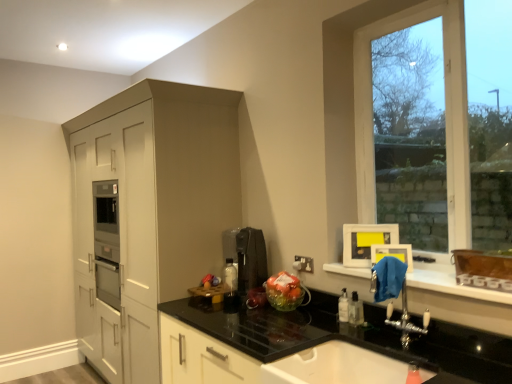
At what (x,y) coordinates should I click in order to perform the action: click on black plastic coffee machine at center. Please return your answer as a coordinate pair (x, y). This screenshot has height=384, width=512. Looking at the image, I should click on (247, 256).

Describe the element at coordinates (347, 336) in the screenshot. I see `black granite countertop at center` at that location.

At what (x,y) coordinates should I click in order to perform the action: click on clear glass window at upper right. Please return your answer as a coordinate pair (x, y). The image size is (512, 384). Looking at the image, I should click on tap(445, 106).

Where is `white glossy sink at lower center`? Image resolution: width=512 pixels, height=384 pixels. white glossy sink at lower center is located at coordinates (335, 366).

Measure the distance between point [275,372] and camera.

Point [275,372] is 5.28 feet away from camera.

Find the location of a particular element. The width and height of the screenshot is (512, 384). blue fabric at lower right is located at coordinates (451, 283).

Is blue fabric at lower right not inside clear plastic bottle at lower right?

Absolutely, blue fabric at lower right is external to clear plastic bottle at lower right.

How different are the orientations of blue fabric at lower right and clear plastic bottle at lower right in degrees?

The angle between the facing direction of blue fabric at lower right and the facing direction of clear plastic bottle at lower right is 0.999 degrees.

From the picture: Which is more to the right, blue fabric at lower right or clear plastic bottle at lower right?

From the viewer's perspective, blue fabric at lower right appears more on the right side.

Measure the distance from blue fabric at lower right to clear plastic bottle at lower right.

blue fabric at lower right and clear plastic bottle at lower right are 14.90 inches apart.

From a real-world perspective, is black plastic coffee machine at center above or below matte white cabinet at left?

Clearly, from a real-world perspective, black plastic coffee machine at center is above matte white cabinet at left.

Can you confirm if black plastic coffee machine at center is bigger than matte white cabinet at left?

Actually, black plastic coffee machine at center might be smaller than matte white cabinet at left.

Measure the distance between black plastic coffee machine at center and matte white cabinet at left.

28.58 inches.

Which of these two, matte white cabinet at left or clear glass window at upper right, stands taller?

With more height is matte white cabinet at left.

Image resolution: width=512 pixels, height=384 pixels. In order to click on window above the matte white cabinet at left (from the image's perspective) in this screenshot , I will do `click(445, 106)`.

Is matte white cabinet at left touching clear glass window at upper right?

matte white cabinet at left and clear glass window at upper right are clearly separated.

Considering the relative sizes of matte white cabinet at left and clear glass window at upper right in the image provided, is matte white cabinet at left thinner than clear glass window at upper right?

No.

In terms of width, does matte white cabinet at left look wider or thinner when compared to blue fabric at lower right?

In the image, matte white cabinet at left appears to be wider than blue fabric at lower right.

Between point (80, 179) and point (434, 278), which one is positioned behind?

Point (80, 179)

From the image's perspective, does matte white cabinet at left appear higher than blue fabric at lower right?

No, from the image's perspective, matte white cabinet at left is not on top of blue fabric at lower right.

Considering the sizes of objects clear plastic bottle at lower right and black plastic coffee machine at center in the image provided, who is thinner, clear plastic bottle at lower right or black plastic coffee machine at center?

clear plastic bottle at lower right is thinner.

Who is shorter, clear plastic bottle at lower right or black plastic coffee machine at center?

Standing shorter between the two is clear plastic bottle at lower right.

Is clear plastic bottle at lower right positioned with its back to black plastic coffee machine at center?

That's not correct — clear plastic bottle at lower right is not looking away from black plastic coffee machine at center.

Is there a large distance between clear plastic bottle at lower right and black plastic coffee machine at center?

They are positioned close to each other.

From their relative heights in the image, would you say blue fabric at lower right is taller or shorter than matte white cabinet at left?

In the image, blue fabric at lower right appears to be shorter than matte white cabinet at left.

Can you see blue fabric at lower right touching matte white cabinet at left?

No, blue fabric at lower right is not beside matte white cabinet at left.

Is blue fabric at lower right turned away from matte white cabinet at left?

No, blue fabric at lower right's orientation is not away from matte white cabinet at left.

Based on the photo, is matte white cabinet at left positioned in front of clear plastic bottle at lower right?

No, matte white cabinet at left is behind clear plastic bottle at lower right.

Is point (160, 109) behind point (359, 313)?

Yes, it is.

In the scene shown: Between matte white cabinet at left and clear plastic bottle at lower right, which one has smaller size?

Smaller between the two is clear plastic bottle at lower right.

From a real-world perspective, does matte white cabinet at left stand above clear plastic bottle at lower right?

Correct, in the physical world, matte white cabinet at left is higher than clear plastic bottle at lower right.

The height and width of the screenshot is (384, 512). In order to click on window sill on the right of clear plastic bottle at lower right in this screenshot , I will do `click(451, 283)`.

Locate an element on the screen. cabinetry on the left of black plastic coffee machine at center is located at coordinates (151, 208).

Looking at the image, which one is located closer to black granite countertop at center, matte white cabinet at left or clear plastic bottle at lower right?

clear plastic bottle at lower right.

Estimate the real-world distances between objects in this image. Which object is further from black plastic coffee machine at center, black granite countertop at center or blue fabric at lower right?

Based on the image, blue fabric at lower right appears to be further to black plastic coffee machine at center.

Considering their positions, is blue fabric at lower right positioned closer to black plastic coffee machine at center than clear glass window at upper right?

clear glass window at upper right is positioned closer to the anchor black plastic coffee machine at center.

Based on their spatial positions, is black plastic coffee machine at center or matte white cabinet at left closer to white glossy sink at lower center?

The object closer to white glossy sink at lower center is black plastic coffee machine at center.

Considering their positions, is matte white cabinet at left positioned further to clear glass window at upper right than black granite countertop at center?

matte white cabinet at left.

Based on their spatial positions, is matte white cabinet at left or black plastic coffee machine at center closer to blue fabric at lower right?

The object closer to blue fabric at lower right is black plastic coffee machine at center.

Based on their spatial positions, is white glossy sink at lower center or matte white cabinet at left closer to black plastic coffee machine at center?

The object closer to black plastic coffee machine at center is matte white cabinet at left.

From the image, which object appears to be nearer to black plastic coffee machine at center, clear glass window at upper right or black granite countertop at center?

black granite countertop at center lies closer to black plastic coffee machine at center than the other object.

Find the location of a particular element. sink located between matte white cabinet at left and blue fabric at lower right in the left-right direction is located at coordinates (335, 366).

Where is `toiletry between black granite countertop at center and black plastic coffee machine at center along the z-axis`? This screenshot has height=384, width=512. toiletry between black granite countertop at center and black plastic coffee machine at center along the z-axis is located at coordinates (355, 310).

Locate an element on the screen. The image size is (512, 384). cabinetry located between black granite countertop at center and black plastic coffee machine at center in the depth direction is located at coordinates (151, 208).

Find the location of a particular element. sink between black granite countertop at center and blue fabric at lower right is located at coordinates (335, 366).